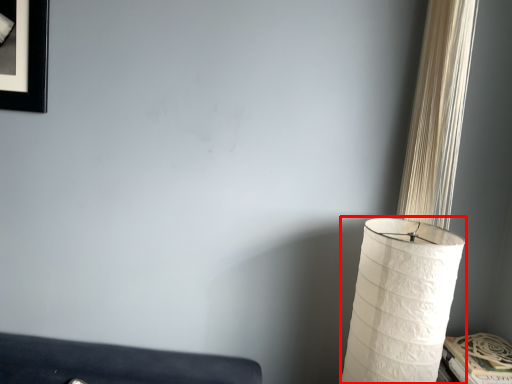
Question: From the image, what is the correct spatial relationship of lamp (annotated by the red box) in relation to curtain?

Choices:
 (A) right
 (B) left

Answer: (B)